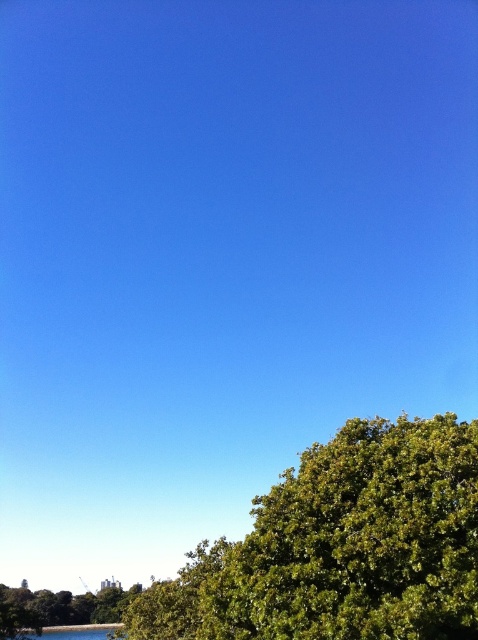
Question: Where is green leafy tree at lower right located in relation to green leafy tree at lower left in the image?

Choices:
 (A) left
 (B) right

Answer: (B)

Question: Does green leafy tree at lower right appear on the left side of green leafy tree at lower left?

Choices:
 (A) yes
 (B) no

Answer: (B)

Question: Which object appears closest to the camera in this image?

Choices:
 (A) green leafy tree at lower right
 (B) green leafy tree at lower left

Answer: (A)

Question: Is green leafy tree at lower right further to camera compared to green leafy tree at lower left?

Choices:
 (A) yes
 (B) no

Answer: (B)